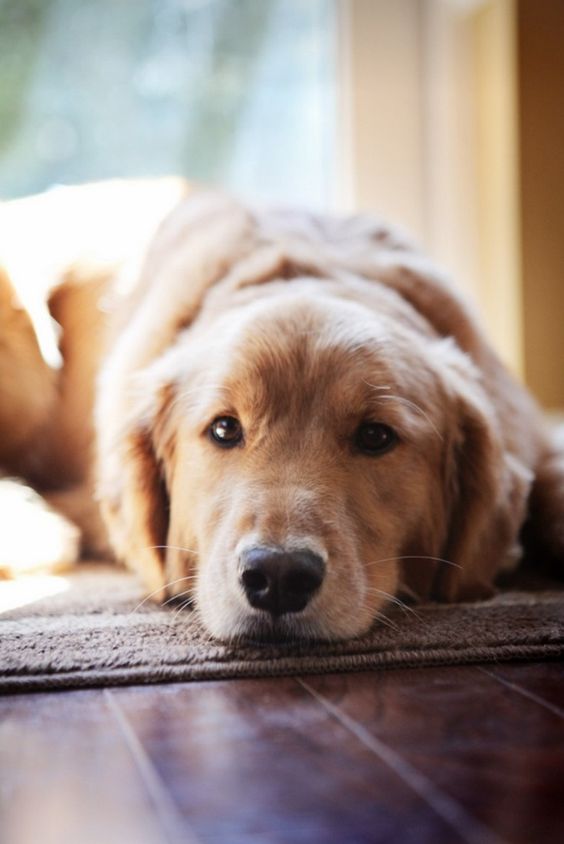
Locate an element on the screen. The image size is (564, 844). floor is located at coordinates (271, 764).